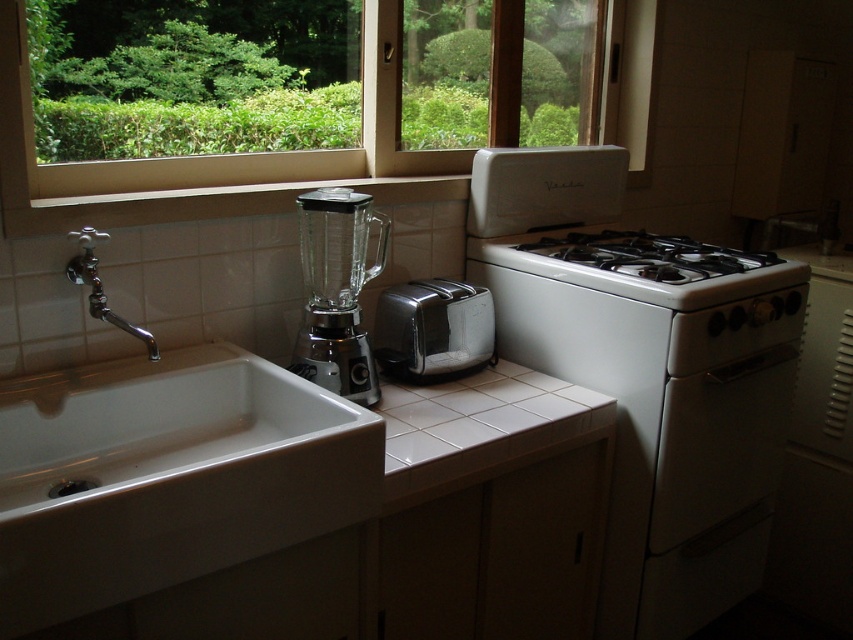
You are standing at the point with coordinates point (347,266) and want to move to the point with coordinates point (540,492). Given that you can only move forward and cannot go through objects, will you be able to reach your destination without any obstacles?

Point (540,492) is behind point (347,266), so you cannot reach it without moving around or going through the object blocking the path.

You are a delivery person who needs to place a small package on the kitchen counter. The package is 15 cm wide. The counter has a sink on the left and a stove on the right. There is also a blender and a toaster near the sink. Where should you place the package so it doesn not block the transparent glass window at upper center?

The transparent glass window at upper center is located at point (219, 154). Since the package is 15 cm wide, you should place it away from the area near the window to avoid blocking it.

You are a chef preparing a meal and need to check if the transparent glass blender at center can be seen from the transparent glass window at upper center. Based on their positions, can you see the blender through the window?

The transparent glass window at upper center is above the transparent glass blender at center, so yes, the blender can be seen through the window since it is positioned directly below the window.